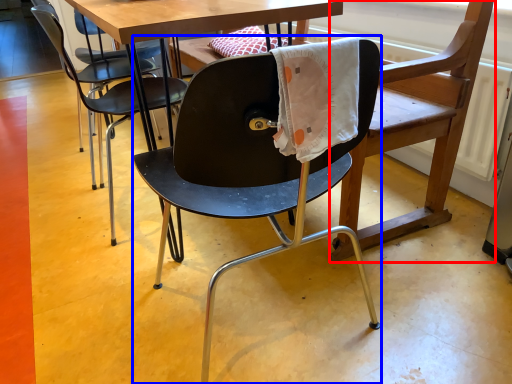
Question: Which point is closer to the camera, swivel chair (highlighted by a red box) or chair (highlighted by a blue box)?

Choices:
 (A) swivel chair
 (B) chair

Answer: (B)